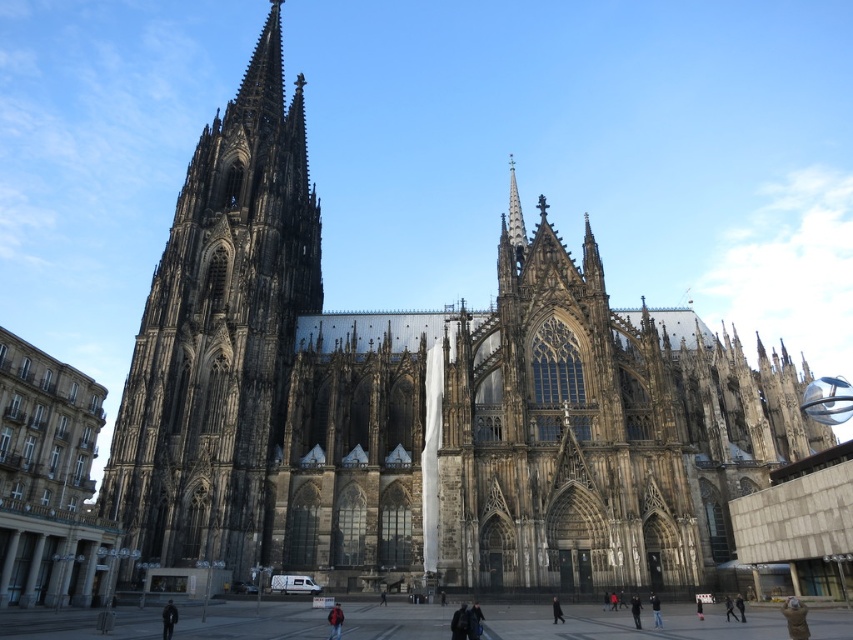
Question: Which point appears farthest from the camera in this image?

Choices:
 (A) (328, 611)
 (B) (173, 612)

Answer: (A)

Question: Which point is farther to the camera?

Choices:
 (A) dark stone tower at left
 (B) dark gray fabric jacket at lower left
 (C) red jacket at center
 (D) black fabric person at center

Answer: (A)

Question: Is dark stone tower at left bigger than dark gray fabric jacket at lower left?

Choices:
 (A) yes
 (B) no

Answer: (A)

Question: Is dark stone tower at left to the right of red jacket at center from the viewer's perspective?

Choices:
 (A) yes
 (B) no

Answer: (B)

Question: Which point is farther to the camera?

Choices:
 (A) (556, 621)
 (B) (334, 634)
 (C) (134, 369)

Answer: (C)

Question: Can you confirm if dark gray fabric jacket at lower left is positioned below black fabric person at center?

Choices:
 (A) yes
 (B) no

Answer: (B)